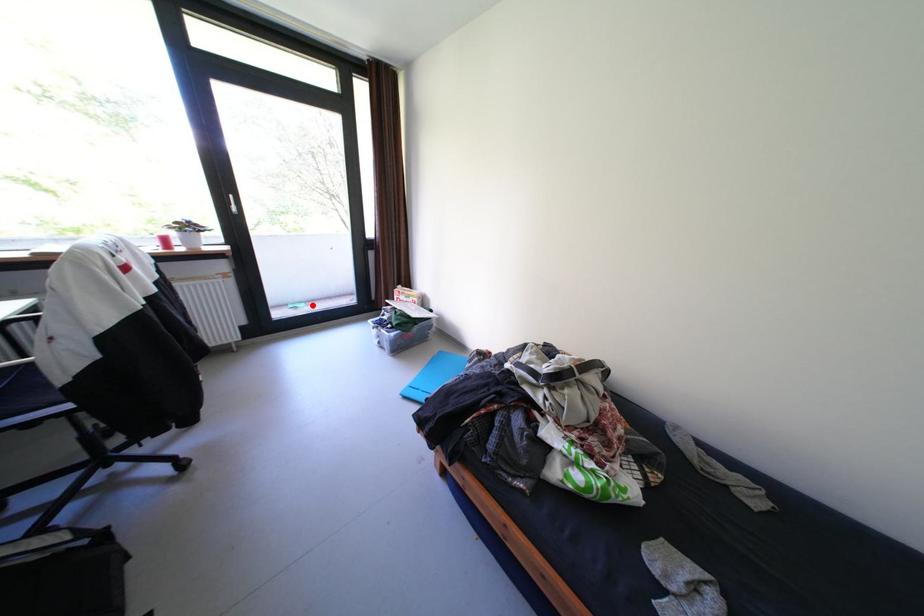
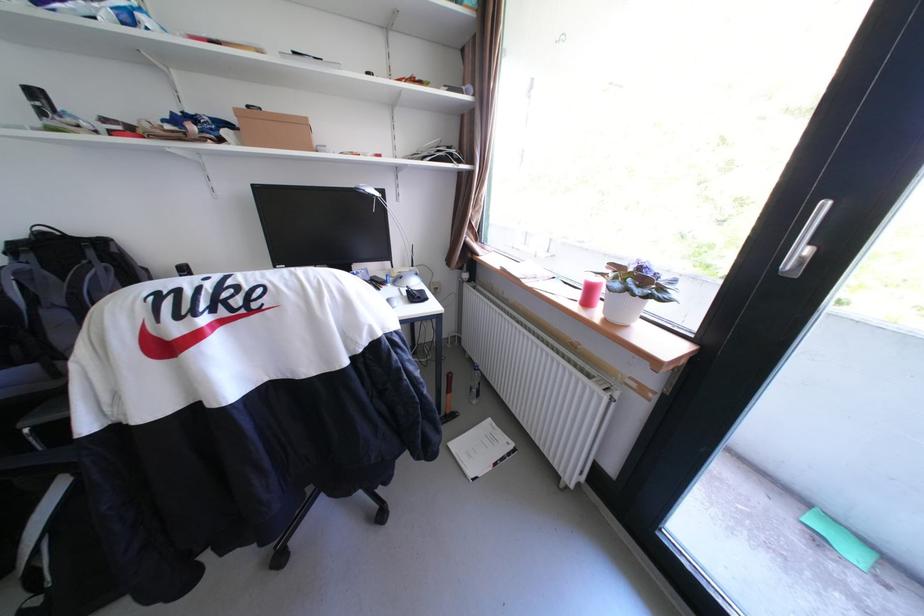
Find the pixel in the second image that matches the highlighted location in the first image.

(867, 554)